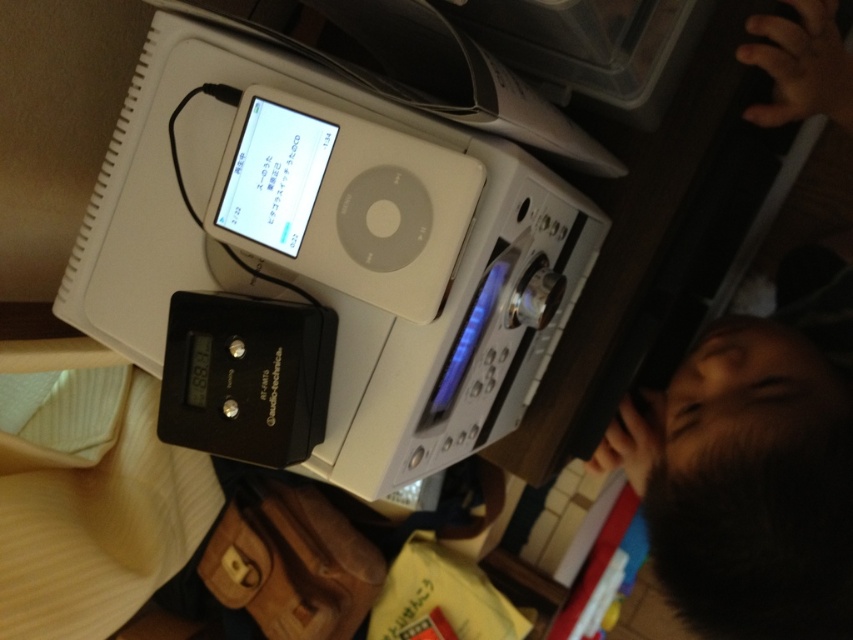
Question: Is white matte ipod at upper center to the right of black plastic ipod at center from the viewer's perspective?

Choices:
 (A) yes
 (B) no

Answer: (A)

Question: Estimate the real-world distances between objects in this image. Which object is farther from the black plastic ipod at center?

Choices:
 (A) black hair at upper right
 (B) white plastic ipod at upper center

Answer: (A)

Question: Does white plastic ipod at upper center have a smaller size compared to black plastic ipod at center?

Choices:
 (A) no
 (B) yes

Answer: (A)

Question: Is white matte ipod at upper center wider than black plastic ipod at center?

Choices:
 (A) yes
 (B) no

Answer: (A)

Question: Which point is farther to the camera?

Choices:
 (A) white matte ipod at upper center
 (B) black plastic ipod at center

Answer: (B)

Question: Based on their relative distances, which object is farther from the white plastic ipod at upper center?

Choices:
 (A) white matte ipod at upper center
 (B) black hair at upper right

Answer: (B)